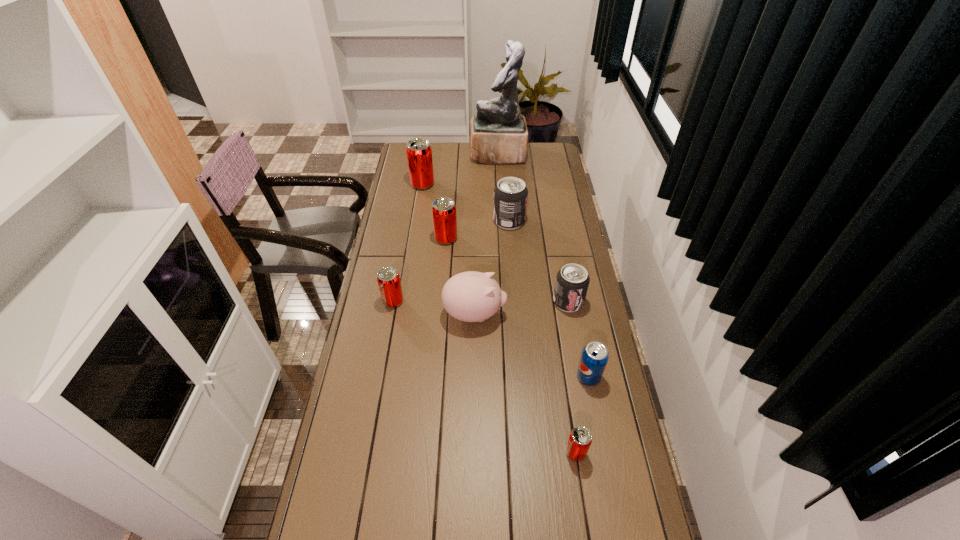
The height and width of the screenshot is (540, 960). What are the coordinates of `soda can identified as the fifth closest to the left black soda can` in the screenshot? It's located at (594, 358).

Select which soda can appears as the second closest to the nearest object. Please provide its 2D coordinates. Your answer should be formatted as a tuple, i.e. [(x, y)], where the tuple contains the x and y coordinates of a point satisfying the conditions above.

[(572, 281)]

Locate which red soda can is the third closest to the third soda can from left to right. Please provide its 2D coordinates. Your answer should be formatted as a tuple, i.e. [(x, y)], where the tuple contains the x and y coordinates of a point satisfying the conditions above.

[(580, 439)]

Identify which red soda can is the second closest to the bigger black soda can. Please provide its 2D coordinates. Your answer should be formatted as a tuple, i.e. [(x, y)], where the tuple contains the x and y coordinates of a point satisfying the conditions above.

[(419, 152)]

Locate an element on the screen. The height and width of the screenshot is (540, 960). black soda can that is the closest to the piggy bank is located at coordinates coord(572,281).

Select which black soda can is the second closest to the smallest red soda can. Please provide its 2D coordinates. Your answer should be formatted as a tuple, i.e. [(x, y)], where the tuple contains the x and y coordinates of a point satisfying the conditions above.

[(510, 194)]

The image size is (960, 540). In order to click on vacant region that satisfies the following two spatial constraints: 1. on the front side of the second tallest object; 2. on the right side of the smaller black soda can in this screenshot , I will do `click(404, 302)`.

Where is `free point that satisfies the following two spatial constraints: 1. in a relaxed pose on the sculpture; 2. on the back side of the nearer black soda can`? free point that satisfies the following two spatial constraints: 1. in a relaxed pose on the sculpture; 2. on the back side of the nearer black soda can is located at coordinates (506, 302).

Where is `free space in the image that satisfies the following two spatial constraints: 1. in a relaxed pose on the right black soda can; 2. on the right side of the farthest object`? This screenshot has height=540, width=960. free space in the image that satisfies the following two spatial constraints: 1. in a relaxed pose on the right black soda can; 2. on the right side of the farthest object is located at coordinates (506, 302).

Image resolution: width=960 pixels, height=540 pixels. In order to click on vacant space that satisfies the following two spatial constraints: 1. on the front side of the nearest red soda can; 2. on the left side of the third biggest red soda can in this screenshot , I will do `click(366, 453)`.